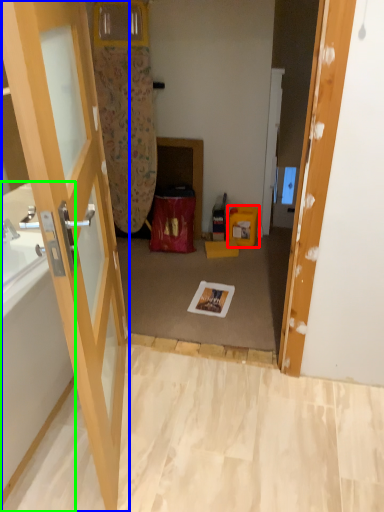
Question: Which object is the closest to the box (highlighted by a red box)? Choose among these: door (highlighted by a blue box) or bathtub (highlighted by a green box).

Choices:
 (A) door
 (B) bathtub

Answer: (A)